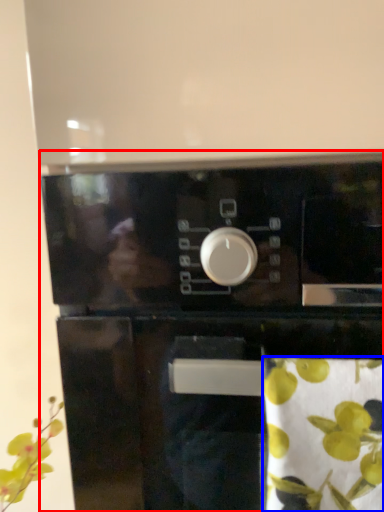
Question: Among these objects, which one is farthest to the camera, home appliance (highlighted by a red box) or flower (highlighted by a blue box)?

Choices:
 (A) home appliance
 (B) flower

Answer: (A)